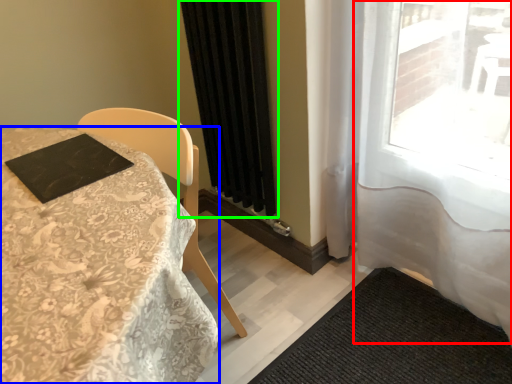
Question: Which object is the farthest from curtain (highlighted by a red box)? Choose among these: table (highlighted by a blue box) or curtain (highlighted by a green box).

Choices:
 (A) table
 (B) curtain

Answer: (A)